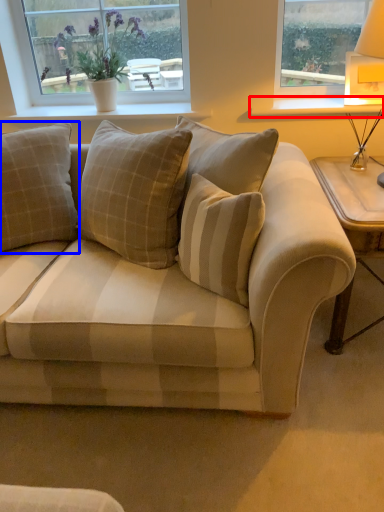
Question: Among these objects, which one is nearest to the camera, window sill (highlighted by a red box) or pillow (highlighted by a blue box)?

Choices:
 (A) window sill
 (B) pillow

Answer: (B)